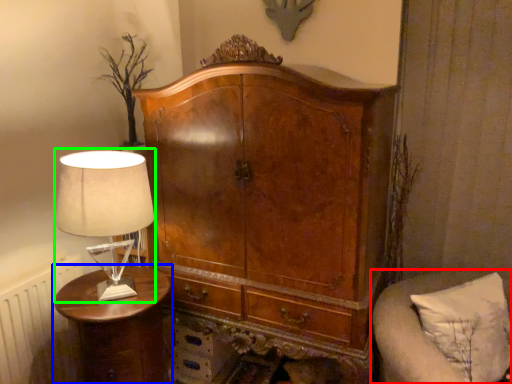
Question: Considering the real-world distances, which object is closest to furniture (highlighted by a red box)? nightstand (highlighted by a blue box) or table lamp (highlighted by a green box).

Choices:
 (A) nightstand
 (B) table lamp

Answer: (A)